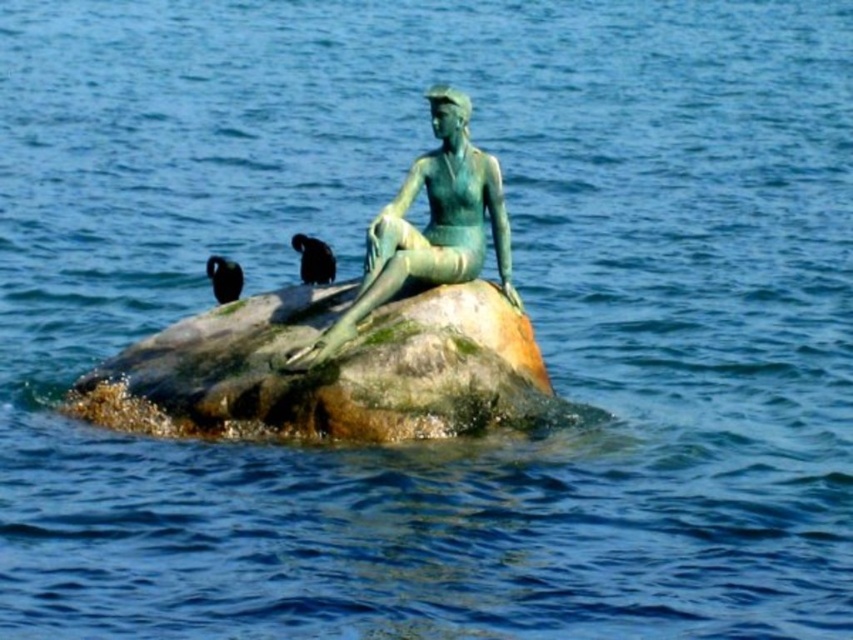
Can you confirm if green patina rock at center is smaller than green patina bronze statue at center?

Actually, green patina rock at center might be larger than green patina bronze statue at center.

I want to click on green patina rock at center, so click(325, 369).